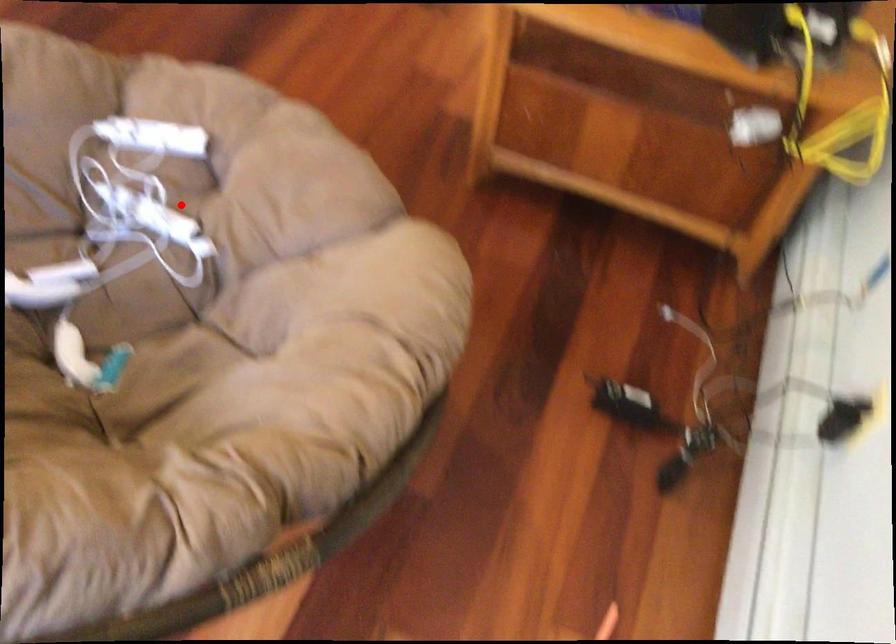
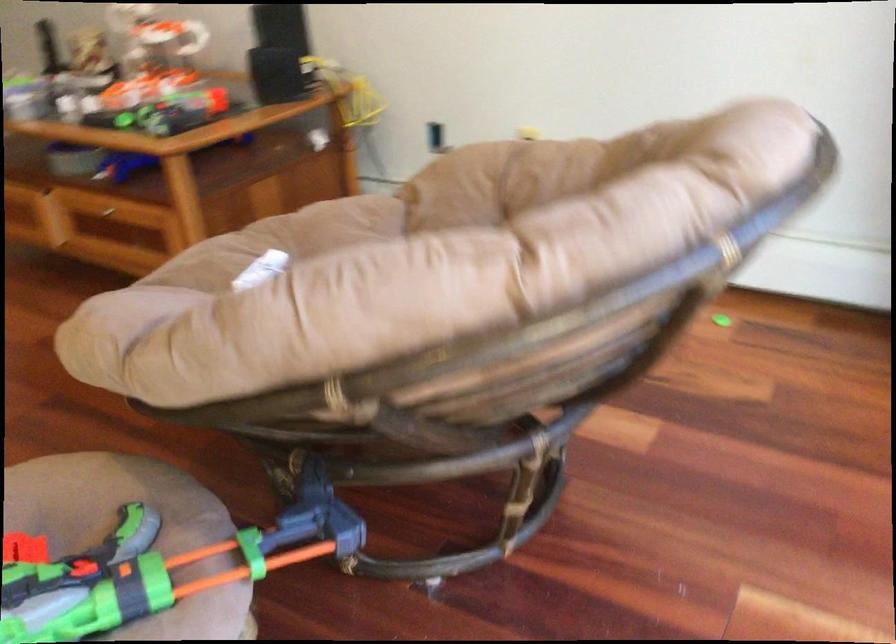
Question: I am providing you with two images of the same scene from different viewpoints. A red point is marked on the first image. Is the red point's position out of view in image 2?

Choices:
 (A) Yes
 (B) No

Answer: (A)